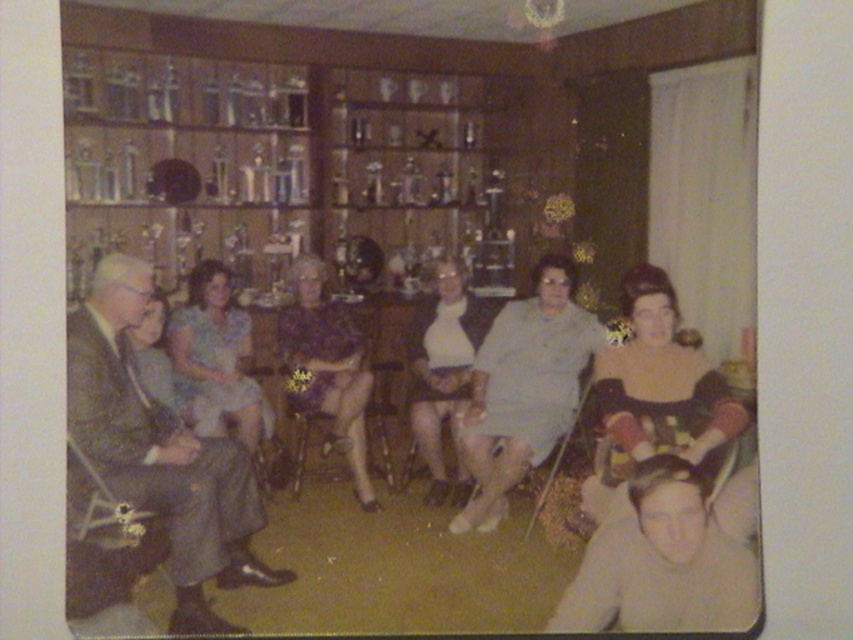
Question: Is light beige fabric dress at center positioned behind matte purple blouse at center?

Choices:
 (A) no
 (B) yes

Answer: (A)

Question: Which point is farther to the camera?

Choices:
 (A) matte purple blouse at center
 (B) gray fabric suit at left

Answer: (A)

Question: Which object is closer to the camera taking this photo?

Choices:
 (A) gray fabric suit at left
 (B) light blue fabric dress at center

Answer: (A)

Question: Among these objects, which one is nearest to the camera?

Choices:
 (A) matte gray suit at center
 (B) gray fabric suit at left
 (C) light brown leather jacket at lower right
 (D) white matte dress at center

Answer: (A)

Question: Is gray fabric suit at left to the right of matte purple blouse at center from the viewer's perspective?

Choices:
 (A) yes
 (B) no

Answer: (B)

Question: Does matte gray suit at center have a greater width compared to light brown leather jacket at lower right?

Choices:
 (A) no
 (B) yes

Answer: (B)